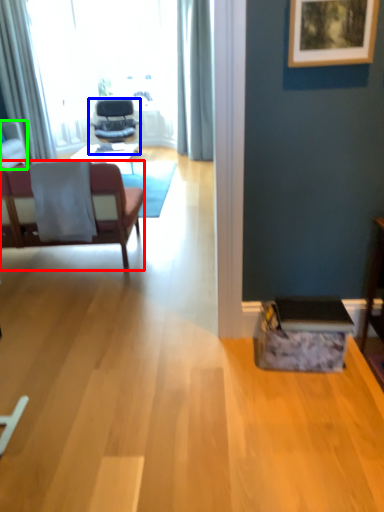
Question: Which object is the closest to the chair (highlighted by a red box)? Choose among these: chair (highlighted by a blue box) or chair (highlighted by a green box).

Choices:
 (A) chair
 (B) chair

Answer: (B)